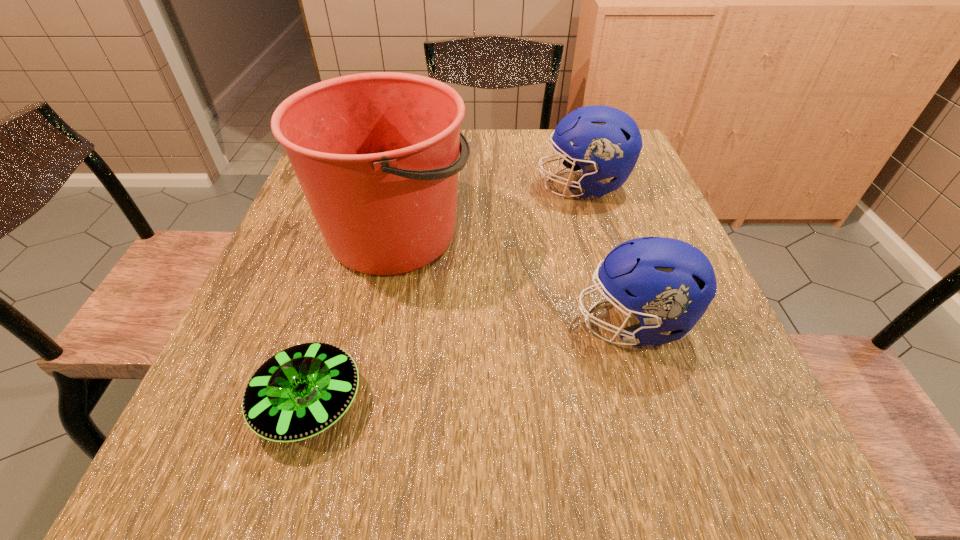
Identify the location of free space located 0.320m on the face guard of the nearer football helmet. [x=398, y=322].

The image size is (960, 540). I want to click on vacant position located 0.210m on the right of the saucer, so click(497, 403).

The height and width of the screenshot is (540, 960). Identify the location of object that is positioned at the far edge. (607, 142).

You are a GUI agent. You are given a task and a screenshot of the screen. Output one action in this format:
    pyautogui.click(x=<x>, y=<y>)
    Task: Click on the object that is at the near edge
    The height and width of the screenshot is (540, 960).
    Given the screenshot: What is the action you would take?
    pyautogui.click(x=301, y=391)

Locate an element on the screen. The image size is (960, 540). bucket positioned at the left edge is located at coordinates (376, 154).

The height and width of the screenshot is (540, 960). Find the location of `saucer that is at the left edge`. saucer that is at the left edge is located at coordinates (301, 391).

Locate an element on the screen. This screenshot has height=540, width=960. object that is at the near left corner is located at coordinates (301, 391).

Locate an element on the screen. The height and width of the screenshot is (540, 960). object that is positioned at the far right corner is located at coordinates (607, 142).

Find the location of a particular element. Image resolution: width=960 pixels, height=540 pixels. vacant area at the far edge of the desktop is located at coordinates (508, 146).

Image resolution: width=960 pixels, height=540 pixels. Identify the location of free location at the left edge of the desktop. (263, 302).